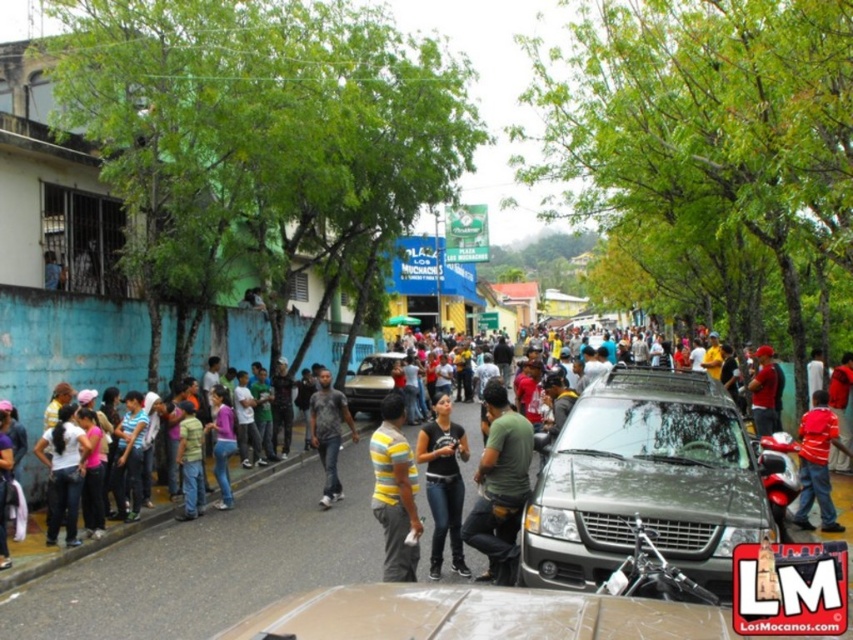
Who is more distant from viewer, (399, 548) or (759, 348)?

The point (759, 348) is more distant.

Is yellow striped shirt at center positioned at the back of matte red cap at center?

No.

Which is behind, point (379, 429) or point (758, 422)?

Point (758, 422)

Image resolution: width=853 pixels, height=640 pixels. Identify the location of yellow striped shirt at center. (393, 490).

Locate an element on the screen. The width and height of the screenshot is (853, 640). metallic gray suv at center is located at coordinates (645, 481).

Does point (573, 532) come behind point (390, 461)?

No, it is not.

This screenshot has width=853, height=640. Find the location of `metallic gray suv at center`. metallic gray suv at center is located at coordinates (645, 481).

From the picture: Is black matte shirt at center taller than matte red cap at center?

Indeed, black matte shirt at center has a greater height compared to matte red cap at center.

Who is lower down, black matte shirt at center or matte red cap at center?

black matte shirt at center is below.

Which is in front, point (448, 467) or point (756, 358)?

Point (448, 467)

At what (x,y) coordinates should I click in order to perform the action: click on black matte shirt at center. Please return your answer as a coordinate pair (x, y). Looking at the image, I should click on (444, 483).